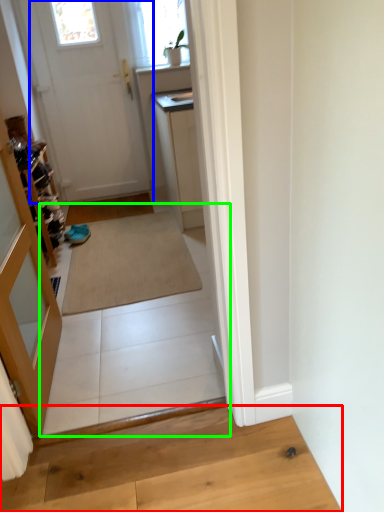
Question: Which is farther away from hardwood (highlighted by a red box)? door (highlighted by a blue box) or path (highlighted by a green box)?

Choices:
 (A) door
 (B) path

Answer: (A)